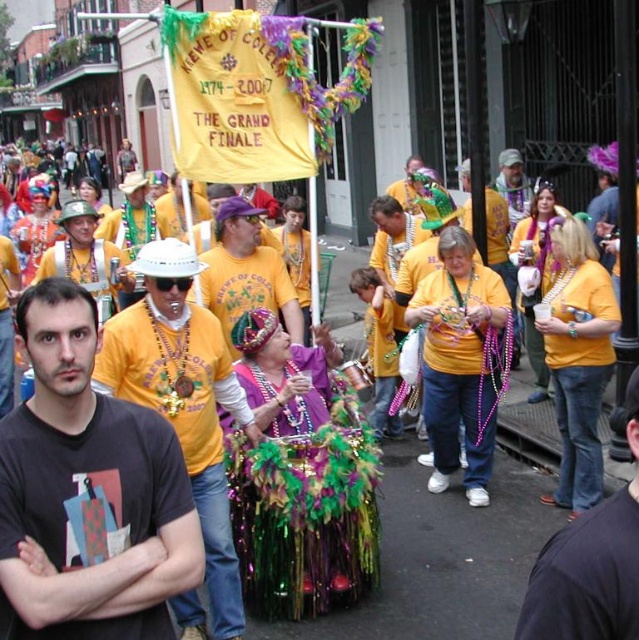
You are a photographer trying to capture the festive atmosphere. You notice the matte yellow shirt at center and the jeans at right in your frame. Based on their positions, which object appears taller?

The matte yellow shirt at center appears taller than the jeans at right.